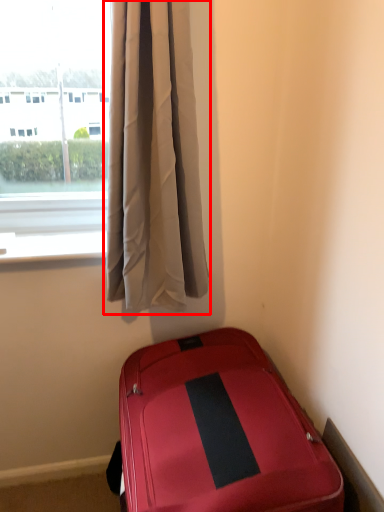
Question: Where is curtain (annotated by the red box) located in relation to suitcase in the image?

Choices:
 (A) right
 (B) left

Answer: (B)